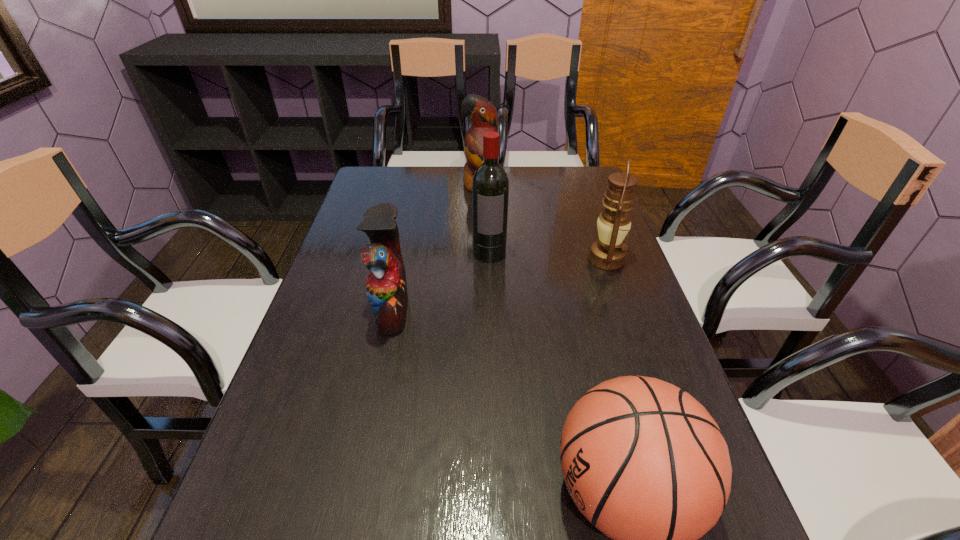
The image size is (960, 540). Find the location of `object positioned at the far edge`. object positioned at the far edge is located at coordinates (482, 113).

In order to click on object that is at the left edge in this screenshot , I will do `click(386, 287)`.

Where is `object that is positioned at the right edge`? object that is positioned at the right edge is located at coordinates (608, 253).

Locate an element on the screen. The image size is (960, 540). free spot at the far edge of the desktop is located at coordinates (512, 179).

In order to click on free region at the left edge of the desktop in this screenshot , I will do `click(350, 367)`.

Where is `vacant region at the right edge`? vacant region at the right edge is located at coordinates (598, 270).

In the image, there is a desktop. Where is `vacant space at the far right corner`? This screenshot has width=960, height=540. vacant space at the far right corner is located at coordinates (585, 173).

Where is `vacant area between the oil lamp and the right parrot`? This screenshot has height=540, width=960. vacant area between the oil lamp and the right parrot is located at coordinates (543, 222).

Locate an element on the screen. This screenshot has height=540, width=960. unoccupied area between the shorter parrot and the taller parrot is located at coordinates (437, 248).

At what (x,y) coordinates should I click in order to perform the action: click on empty space that is in between the oil lamp and the farthest object. Please return your answer as a coordinate pair (x, y). The width and height of the screenshot is (960, 540). Looking at the image, I should click on (543, 222).